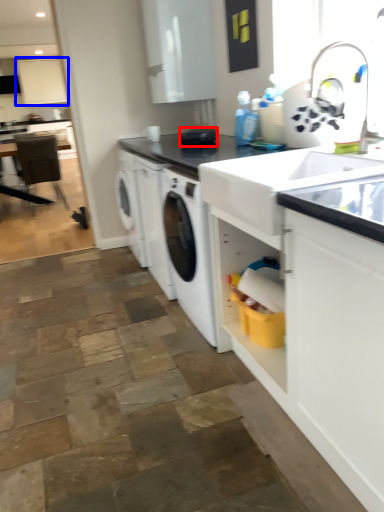
Question: Which object appears closest to the camera in this image, appliance (highlighted by a red box) or cabinetry (highlighted by a blue box)?

Choices:
 (A) appliance
 (B) cabinetry

Answer: (A)